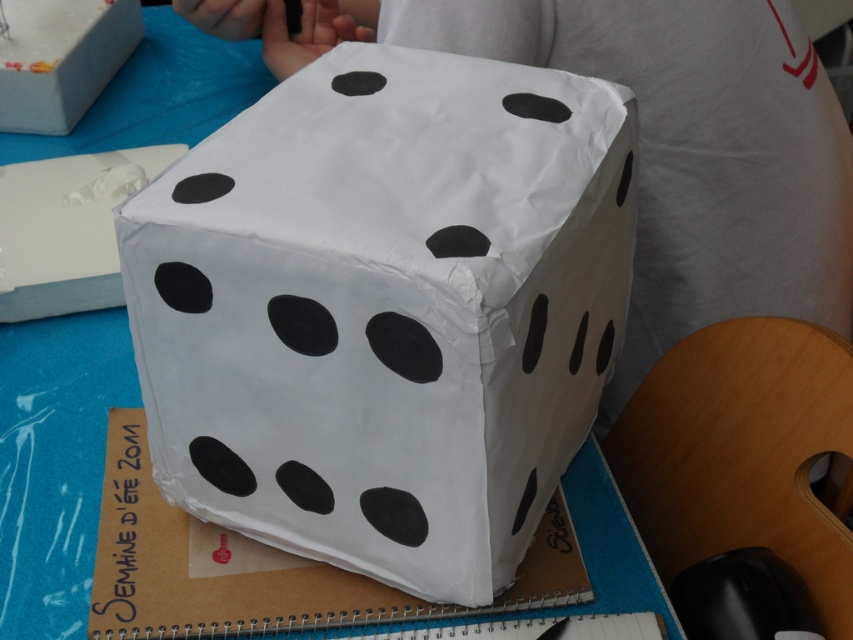
Question: Is white paper dice at center below white paper box at upper left?

Choices:
 (A) no
 (B) yes

Answer: (B)

Question: Does white paper dice at center come in front of white paper box at upper left?

Choices:
 (A) yes
 (B) no

Answer: (A)

Question: Is white paper dice at center behind white paper box at upper left?

Choices:
 (A) no
 (B) yes

Answer: (A)